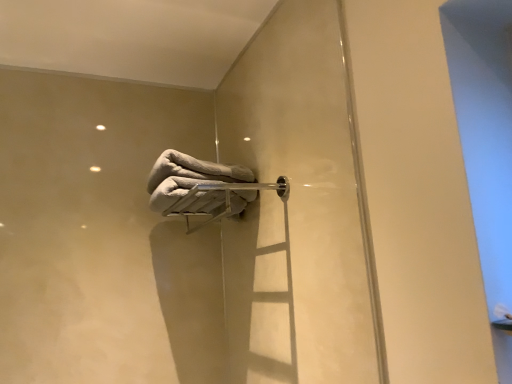
Question: From the image's perspective, is gray fluffy towel at center above or below satin silver towel bar at center?

Choices:
 (A) above
 (B) below

Answer: (A)

Question: Looking at the image, does gray fluffy towel at center seem bigger or smaller compared to satin silver towel bar at center?

Choices:
 (A) small
 (B) big

Answer: (A)

Question: Which is correct: gray fluffy towel at center is inside satin silver towel bar at center, or outside of it?

Choices:
 (A) inside
 (B) outside

Answer: (B)

Question: Choose the correct answer: Is satin silver towel bar at center inside gray fluffy towel at center or outside it?

Choices:
 (A) inside
 (B) outside

Answer: (B)

Question: Is point (285, 178) closer or farther from the camera than point (232, 173)?

Choices:
 (A) farther
 (B) closer

Answer: (B)

Question: Is satin silver towel bar at center wider or thinner than gray fluffy towel at center?

Choices:
 (A) wide
 (B) thin

Answer: (B)

Question: In the image, is satin silver towel bar at center positioned in front of or behind gray fluffy towel at center?

Choices:
 (A) behind
 (B) front

Answer: (B)